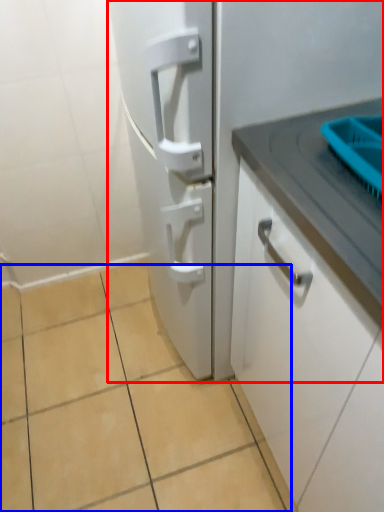
Question: Which point is further to the camera, refrigerator (highlighted by a red box) or ceramic tile (highlighted by a blue box)?

Choices:
 (A) refrigerator
 (B) ceramic tile

Answer: (B)